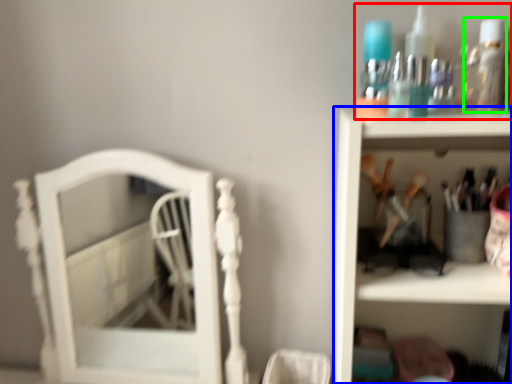
Question: Which is farther away from collection (highlighted by a red box)? shelf (highlighted by a blue box) or mouthwash (highlighted by a green box)?

Choices:
 (A) shelf
 (B) mouthwash

Answer: (A)